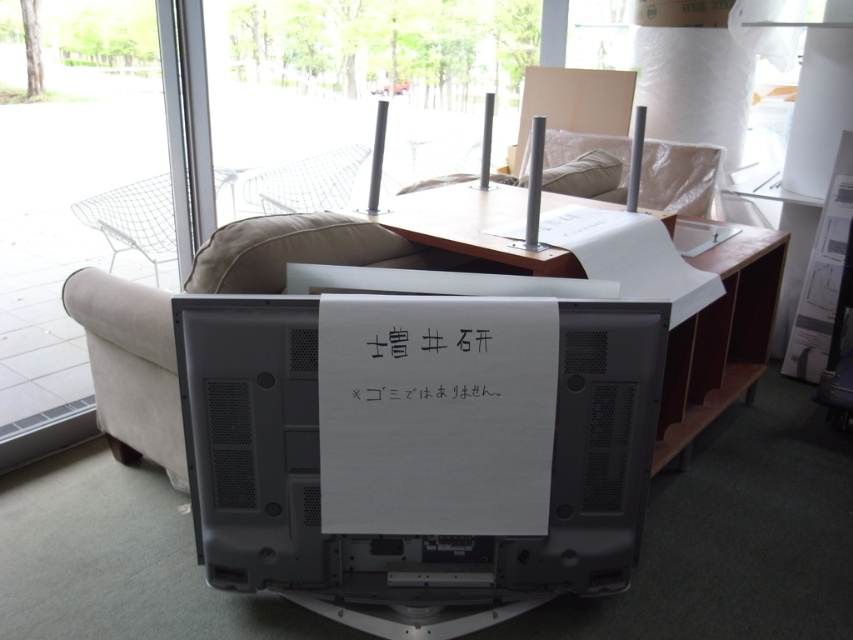
Identify the location of wooden table at center. (473, 227).

I want to click on wooden table at center, so click(x=473, y=227).

Does white paper at center have a smaller size compared to beige fabric pillow at upper center?

Indeed, white paper at center has a smaller size compared to beige fabric pillow at upper center.

Consider the image. Can you confirm if white paper at center is taller than beige fabric pillow at upper center?

Incorrect, white paper at center's height is not larger of beige fabric pillow at upper center's.

Between point (482, 340) and point (558, 184), which one is positioned in front?

Point (482, 340)

Where is `white paper at center`? This screenshot has height=640, width=853. white paper at center is located at coordinates (422, 364).

Is white fabric couch at center wider than beige fabric pillow at upper center?

Yes.

Who is higher up, white fabric couch at center or beige fabric pillow at upper center?

beige fabric pillow at upper center is higher up.

Is point (152, 296) farther from camera compared to point (595, 179)?

No, it is in front of (595, 179).

The height and width of the screenshot is (640, 853). Identify the location of white fabric couch at center. (720, 339).